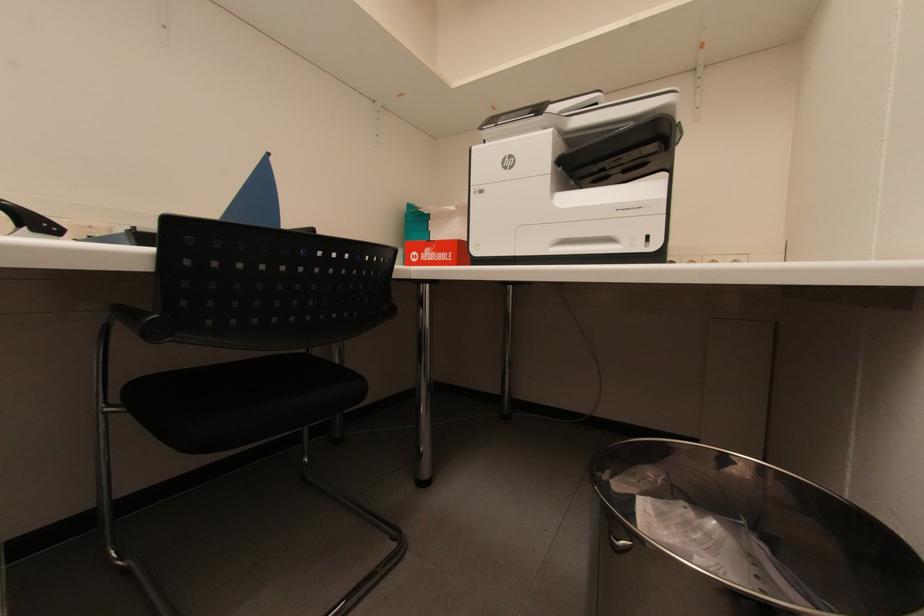
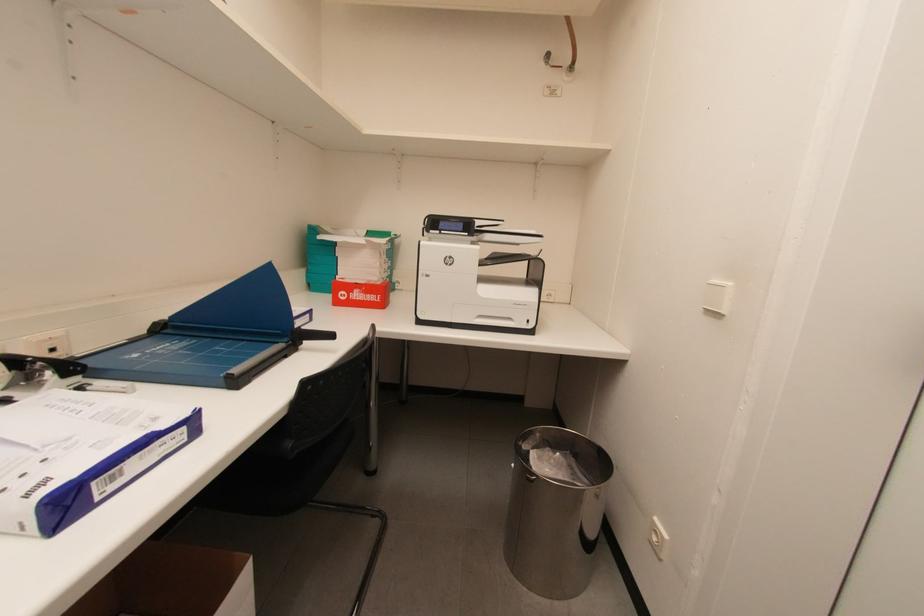
Question: How did the camera likely rotate?

Choices:
 (A) Left
 (B) Right
 (C) Up
 (D) Down

Answer: (B)